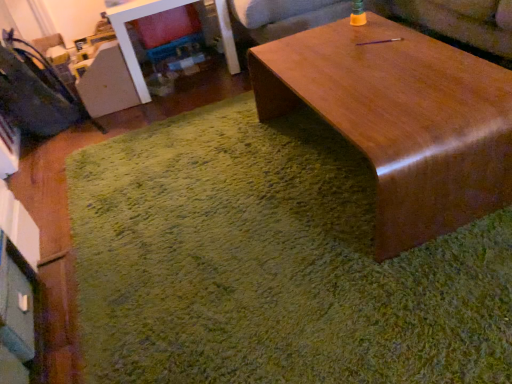
Locate an element on the screen. The height and width of the screenshot is (384, 512). vacant area on top of glossy wood coffee table at center (from a real-world perspective) is located at coordinates (367, 82).